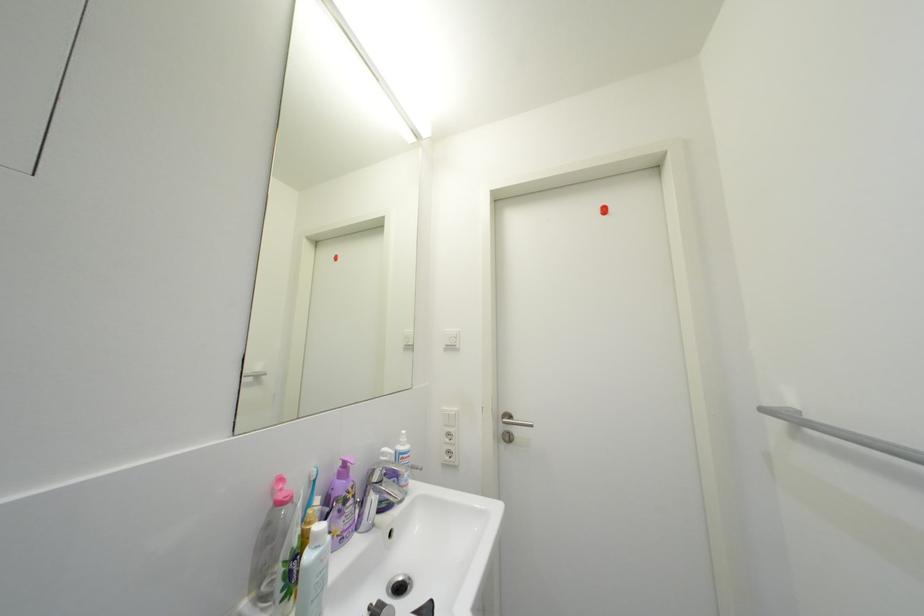
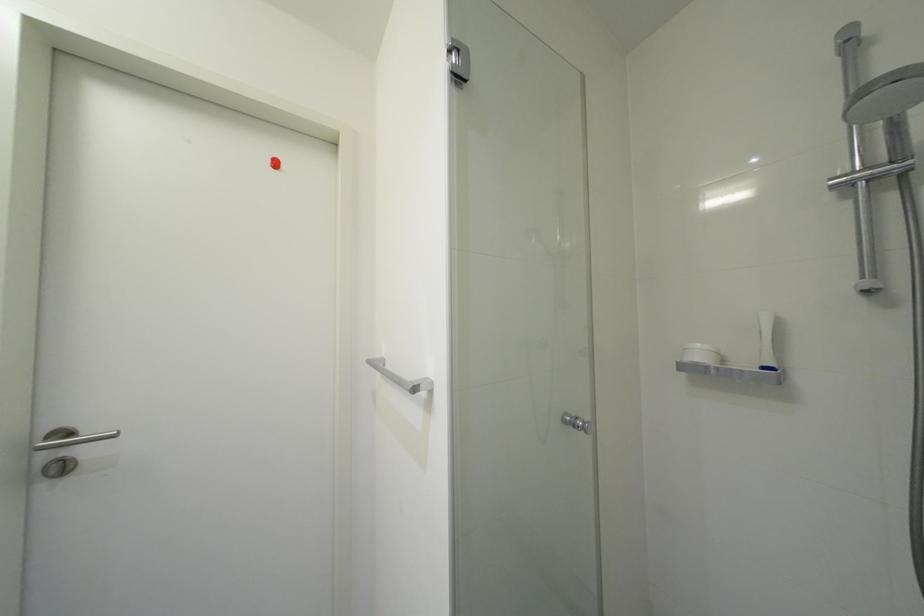
Question: Based on the continuous images, in which direction is the camera rotating? Reply with the corresponding letter.

Choices:
 (A) Left
 (B) Right
 (C) Up
 (D) Down

Answer: (B)